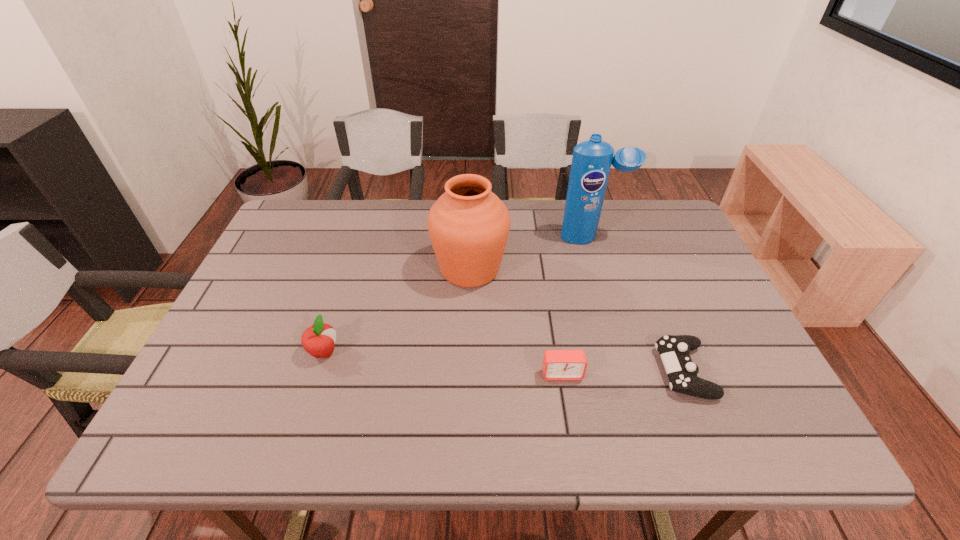
Where is `vacant point located between the control and the apple`? This screenshot has width=960, height=540. vacant point located between the control and the apple is located at coordinates (504, 361).

Locate an element on the screen. This screenshot has width=960, height=540. vacant space that's between the shampoo and the third tallest object is located at coordinates (458, 295).

Locate an element on the screen. The height and width of the screenshot is (540, 960). empty space that is in between the tallest object and the third object from left to right is located at coordinates (577, 306).

Where is `free space between the shortest object and the fourth shortest object`? This screenshot has width=960, height=540. free space between the shortest object and the fourth shortest object is located at coordinates pyautogui.click(x=577, y=320).

At what (x,y) coordinates should I click in order to perform the action: click on vacant space in between the apple and the fourth shortest object. Please return your answer as a coordinate pair (x, y). Image resolution: width=960 pixels, height=540 pixels. Looking at the image, I should click on (396, 310).

Select which object appears as the closest to the apple. Please provide its 2D coordinates. Your answer should be formatted as a tuple, i.e. [(x, y)], where the tuple contains the x and y coordinates of a point satisfying the conditions above.

[(468, 225)]

At what (x,y) coordinates should I click in order to perform the action: click on object that is the second closest to the second shortest object. Please return your answer as a coordinate pair (x, y). Looking at the image, I should click on (468, 225).

In order to click on free space that satisfies the following two spatial constraints: 1. on the back side of the shampoo; 2. on the right side of the apple in this screenshot , I will do `click(360, 238)`.